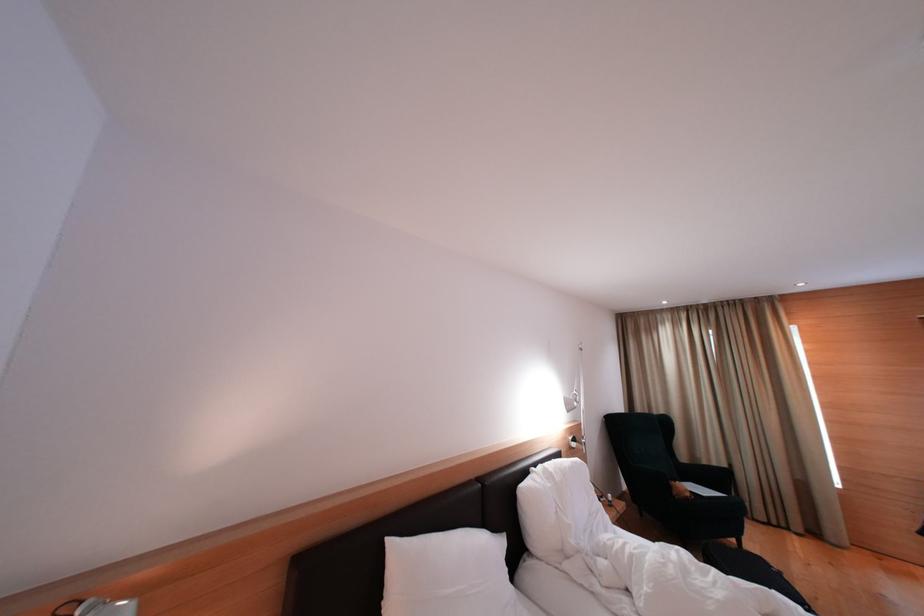
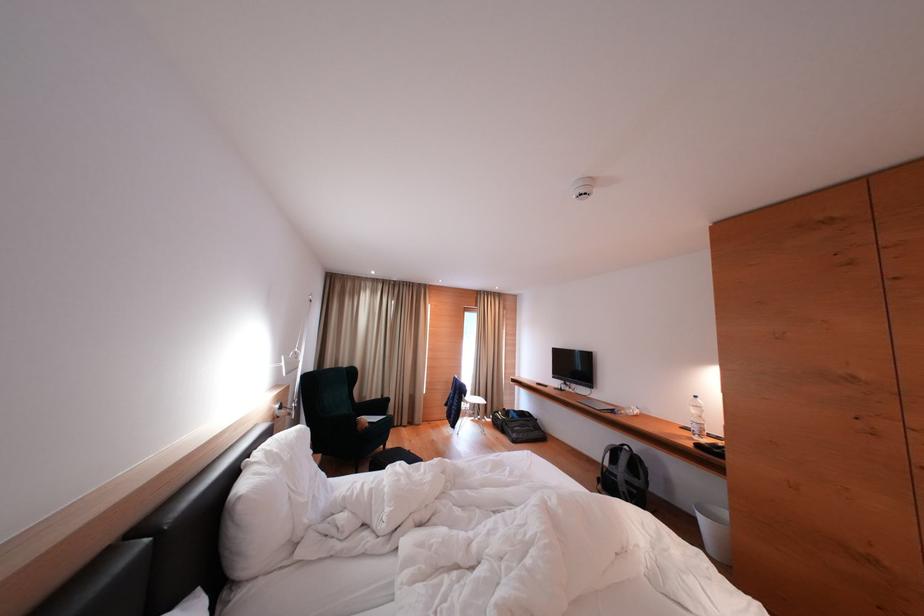
Locate, in the second image, the point that corresponds to (573,442) in the first image.

(277, 411)